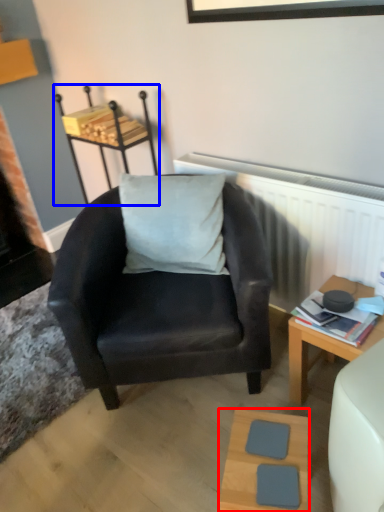
Question: Which of the following is the closest to the observer, table (highlighted by a red box) or stool (highlighted by a blue box)?

Choices:
 (A) table
 (B) stool

Answer: (A)